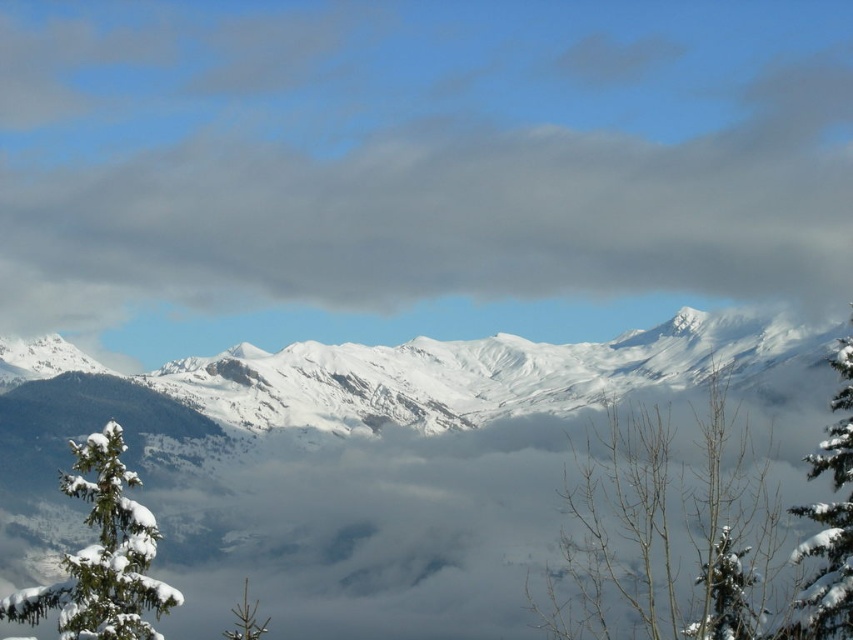
Is white snow-covered mountain range at center above white snow-covered tree at right?

No.

Is white snow-covered mountain range at center to the right of white snow-covered tree at right from the viewer's perspective?

In fact, white snow-covered mountain range at center is to the left of white snow-covered tree at right.

Locate an element on the screen. The image size is (853, 640). white snow-covered mountain range at center is located at coordinates pos(381,461).

Where is `white snow-covered mountain range at center`? white snow-covered mountain range at center is located at coordinates (381, 461).

Is white snow-covered mountain range at center to the right of green matte tree at lower left from the viewer's perspective?

Correct, you'll find white snow-covered mountain range at center to the right of green matte tree at lower left.

Can you confirm if white snow-covered mountain range at center is wider than green matte tree at lower left?

Yes, white snow-covered mountain range at center is wider than green matte tree at lower left.

This screenshot has width=853, height=640. What are the coordinates of `white snow-covered mountain range at center` in the screenshot? It's located at (381, 461).

You are a GUI agent. You are given a task and a screenshot of the screen. Output one action in this format:
    pyautogui.click(x=<x>, y=<y>)
    Task: Click on the white snow-covered mountain range at center
    The image size is (853, 640).
    Given the screenshot: What is the action you would take?
    pyautogui.click(x=381, y=461)

The height and width of the screenshot is (640, 853). Describe the element at coordinates (666, 531) in the screenshot. I see `snow-covered branches at center` at that location.

Describe the element at coordinates (666, 531) in the screenshot. I see `snow-covered branches at center` at that location.

This screenshot has width=853, height=640. What are the coordinates of `snow-covered branches at center` in the screenshot? It's located at (666, 531).